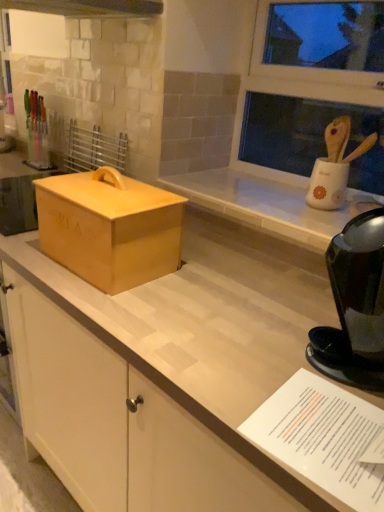
Question: Is matte yellow box at center bigger than white paper at lower right?

Choices:
 (A) yes
 (B) no

Answer: (A)

Question: Could you tell me if matte yellow box at center is turned towards white paper at lower right?

Choices:
 (A) no
 (B) yes

Answer: (A)

Question: Considering the relative positions of matte yellow box at center and white paper at lower right in the image provided, is matte yellow box at center behind white paper at lower right?

Choices:
 (A) no
 (B) yes

Answer: (B)

Question: Considering the relative positions of matte yellow box at center and white paper at lower right in the image provided, is matte yellow box at center in front of white paper at lower right?

Choices:
 (A) no
 (B) yes

Answer: (A)

Question: From a real-world perspective, is matte yellow box at center positioned over white paper at lower right based on gravity?

Choices:
 (A) yes
 (B) no

Answer: (A)

Question: Can white paper at lower right be found inside matte yellow box at center?

Choices:
 (A) no
 (B) yes

Answer: (A)

Question: Is black glossy coffee maker at right outside matte yellow box at center?

Choices:
 (A) no
 (B) yes

Answer: (B)

Question: Considering the relative sizes of black glossy coffee maker at right and matte yellow box at center in the image provided, is black glossy coffee maker at right thinner than matte yellow box at center?

Choices:
 (A) no
 (B) yes

Answer: (B)

Question: Is black glossy coffee maker at right next to matte yellow box at center and touching it?

Choices:
 (A) yes
 (B) no

Answer: (B)

Question: Can matte yellow box at center be found inside black glossy coffee maker at right?

Choices:
 (A) yes
 (B) no

Answer: (B)

Question: Can you confirm if black glossy coffee maker at right is smaller than matte yellow box at center?

Choices:
 (A) no
 (B) yes

Answer: (B)

Question: Is black glossy coffee maker at right oriented towards matte yellow box at center?

Choices:
 (A) no
 (B) yes

Answer: (A)

Question: Does black glossy coffee maker at right come behind white paper at lower right?

Choices:
 (A) yes
 (B) no

Answer: (A)